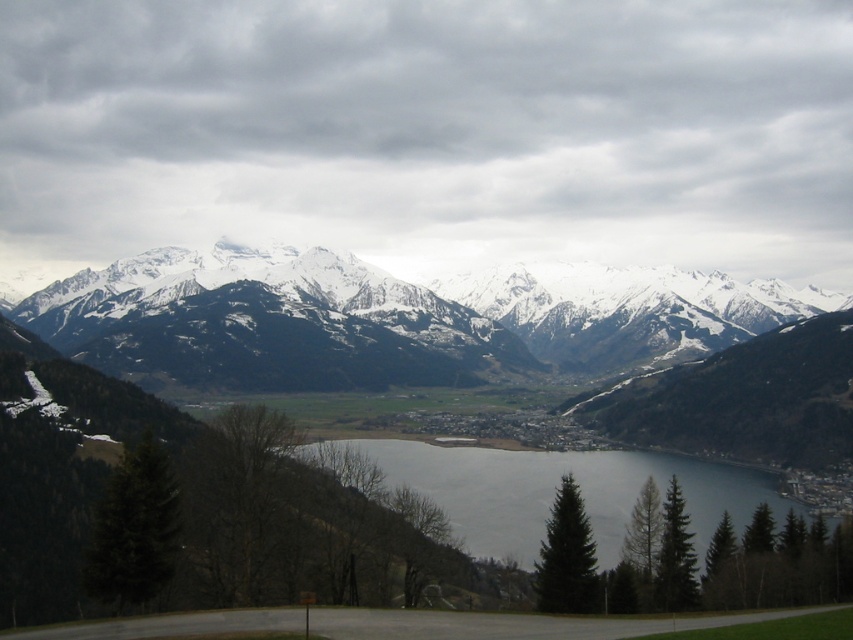
Question: Is white snow-covered mountains at upper center bigger than gray water at center?

Choices:
 (A) yes
 (B) no

Answer: (A)

Question: Is white snow-covered mountains at upper center further to camera compared to gray water at center?

Choices:
 (A) yes
 (B) no

Answer: (A)

Question: Which object appears farthest from the camera in this image?

Choices:
 (A) white snow-covered mountains at upper center
 (B) gray water at center

Answer: (A)

Question: Is white snow-covered mountains at upper center bigger than gray water at center?

Choices:
 (A) no
 (B) yes

Answer: (B)